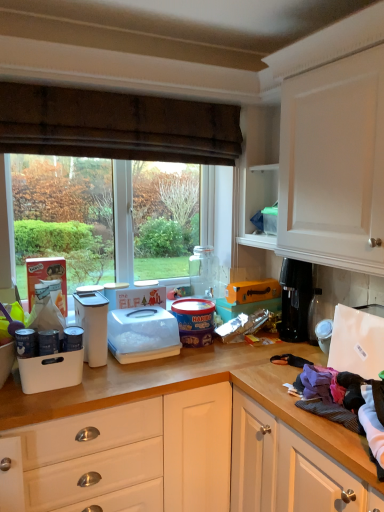
Measure the distance between point (239, 309) and camera.

Point (239, 309) is 7.56 feet from camera.

Measure the distance between white plastic bread bin at center, the fifth appliance positioned from the right, and camera.

1.92 meters.

Where is `transparent glass window at center`? This screenshot has height=512, width=384. transparent glass window at center is located at coordinates (116, 125).

What do you see at coordinates (116, 125) in the screenshot? I see `transparent glass window at center` at bounding box center [116, 125].

Describe the element at coordinates (252, 291) in the screenshot. This screenshot has height=512, width=384. I see `orange cardboard box at center, positioned as the first box in top-to-bottom order` at that location.

Identify the location of metallic silver canister at left, which ranks as the seventh appliance in right-to-left order. The height and width of the screenshot is (512, 384). (26, 342).

From the image's perspective, who appears lower, matte plastic tub at center, which is the 5th appliance from left to right, or white plastic cutting board at right, positioned as the first appliance in right-to-left order?

From the image's view, matte plastic tub at center, which is the 5th appliance from left to right, is below.

Between matte plastic tub at center, placed as the third appliance when sorted from right to left, and white plastic cutting board at right, placed as the 7th appliance when sorted from left to right, which one appears on the left side from the viewer's perspective?

Positioned to the left is matte plastic tub at center, placed as the third appliance when sorted from right to left.

Which object is thinner, matte plastic tub at center, which is the 5th appliance from left to right, or white plastic cutting board at right, positioned as the first appliance in right-to-left order?

With smaller width is white plastic cutting board at right, positioned as the first appliance in right-to-left order.

Considering the relative positions of white plastic container at center, the fourth appliance from the right, and orange matte box at center, placed as the 1th box when sorted from bottom to top, in the image provided, is white plastic container at center, the fourth appliance from the right, to the right of orange matte box at center, placed as the 1th box when sorted from bottom to top, from the viewer's perspective?

In fact, white plastic container at center, the fourth appliance from the right, is to the left of orange matte box at center, placed as the 1th box when sorted from bottom to top.

Which object is further away from the camera taking this photo, white plastic container at center, the fourth appliance from the right, or orange matte box at center, which is the 2th box from top to bottom?

orange matte box at center, which is the 2th box from top to bottom, is further from the camera.

Locate an element on the screen. The width and height of the screenshot is (384, 512). appliance that is the 2nd one when counting leftward from the orange matte box at center, placed as the 1th box when sorted from bottom to top is located at coordinates (142, 334).

From the image's perspective, which one is positioned higher, white plastic container at center, the fourth appliance from the right, or orange matte box at center, which is the 2th box from top to bottom?

orange matte box at center, which is the 2th box from top to bottom, is shown above in the image.

Is point (237, 138) closer or farther from the camera than point (99, 301)?

Clearly, point (237, 138) is more distant from the camera than point (99, 301).

From a real-world perspective, who is located higher, transparent glass window at center or white plastic bread bin at center?

transparent glass window at center, from a real-world perspective.

What's the angular difference between transparent glass window at center and white plastic bread bin at center's facing directions?

The facing directions of transparent glass window at center and white plastic bread bin at center are 1.6 degrees apart.

Does transparent glass window at center contain white plastic bread bin at center?

That's incorrect, white plastic bread bin at center is not inside transparent glass window at center.

Does white plastic cutting board at right, placed as the 7th appliance when sorted from left to right, lie behind matte plastic tub at center, which is the 5th appliance from left to right?

No, it is in front of matte plastic tub at center, which is the 5th appliance from left to right.

From a real-world perspective, is white plastic cutting board at right, placed as the 7th appliance when sorted from left to right, above or below matte plastic tub at center, placed as the third appliance when sorted from right to left?

Clearly, from a real-world perspective, white plastic cutting board at right, placed as the 7th appliance when sorted from left to right, is above matte plastic tub at center, placed as the third appliance when sorted from right to left.

From the image's perspective, which is below, white plastic cutting board at right, placed as the 7th appliance when sorted from left to right, or matte plastic tub at center, placed as the third appliance when sorted from right to left?

matte plastic tub at center, placed as the third appliance when sorted from right to left, appears lower in the image.

From the picture: Is white plastic cutting board at right, positioned as the first appliance in right-to-left order, positioned far away from matte plastic tub at center, placed as the third appliance when sorted from right to left?

That's not correct — white plastic cutting board at right, positioned as the first appliance in right-to-left order, is a little close to matte plastic tub at center, placed as the third appliance when sorted from right to left.

From a real-world perspective, is transparent glass window at center on matte plastic tub at center, placed as the third appliance when sorted from right to left?

Indeed, from a real-world perspective, transparent glass window at center stands above matte plastic tub at center, placed as the third appliance when sorted from right to left.

Which point is more forward, (x=204, y=152) or (x=178, y=310)?

Point (x=178, y=310)

Which object is positioned more to the right, transparent glass window at center or matte plastic tub at center, which is the 5th appliance from left to right?

matte plastic tub at center, which is the 5th appliance from left to right, is more to the right.

Considering the sizes of objects transparent glass window at center and matte plastic tub at center, placed as the third appliance when sorted from right to left, in the image provided, who is thinner, transparent glass window at center or matte plastic tub at center, placed as the third appliance when sorted from right to left,?

Thinner between the two is transparent glass window at center.

Does point (132, 333) appear closer or farther from the camera than point (338, 352)?

Clearly, point (132, 333) is more distant from the camera than point (338, 352).

From their relative heights in the image, would you say white plastic container at center, which is the fourth appliance in left-to-right order, is taller or shorter than white plastic cutting board at right, positioned as the first appliance in right-to-left order?

white plastic container at center, which is the fourth appliance in left-to-right order, is shorter than white plastic cutting board at right, positioned as the first appliance in right-to-left order.

From a real-world perspective, is white plastic container at center, the fourth appliance from the right, positioned above or below white plastic cutting board at right, placed as the 7th appliance when sorted from left to right?

In terms of real-world spatial position, white plastic container at center, the fourth appliance from the right, is below white plastic cutting board at right, placed as the 7th appliance when sorted from left to right.

Relative to white plastic cutting board at right, positioned as the first appliance in right-to-left order, is white plastic container at center, the fourth appliance from the right, in front or behind?

In the image, white plastic container at center, the fourth appliance from the right, appears behind white plastic cutting board at right, positioned as the first appliance in right-to-left order.

How far apart are white plastic bread bin at center and white plastic container at center, which is the fourth appliance in left-to-right order?

They are 5.25 inches apart.

From a real-world perspective, which appliance is the 1st one underneath the white plastic bread bin at center? Please provide its 2D coordinates.

[(142, 334)]

Considering the relative sizes of white plastic bread bin at center and white plastic container at center, which is the fourth appliance in left-to-right order, in the image provided, is white plastic bread bin at center shorter than white plastic container at center, which is the fourth appliance in left-to-right order,?

No.

Between white plastic bread bin at center and white plastic container at center, the fourth appliance from the right, which one is positioned in front?

Positioned in front is white plastic bread bin at center.

Identify the location of the 2nd appliance to the right of the matte plastic tub at center, placed as the third appliance when sorted from right to left, starting your count from the anchor. (357, 342).

Which appliance is the 2nd one when counting from the left side of the orange matte box at center, which is the 2th box from top to bottom? Please provide its 2D coordinates.

[(142, 334)]

Based on their spatial positions, is metallic silver canister at left, which ranks as the seventh appliance in right-to-left order, or white plastic cutting board at right, placed as the 7th appliance when sorted from left to right, closer to matte plastic tub at center, placed as the third appliance when sorted from right to left?

white plastic cutting board at right, placed as the 7th appliance when sorted from left to right, is positioned closer to the anchor matte plastic tub at center, placed as the third appliance when sorted from right to left.

Based on their spatial positions, is orange matte box at center, which is the 2th box from top to bottom, or transparent glass window at center further from white plastic cutting board at right, placed as the 7th appliance when sorted from left to right?

transparent glass window at center lies further to white plastic cutting board at right, placed as the 7th appliance when sorted from left to right, than the other object.

From the image, which object appears to be nearer to white plastic bread bin at center, metallic silver canister at center-left, the second appliance from the left, or brown textured curtain at upper center?

Among the two, metallic silver canister at center-left, the second appliance from the left, is located nearer to white plastic bread bin at center.

Based on their spatial positions, is brown textured curtain at upper center or orange cardboard box at center, which is the 2th box in bottom-to-top order, further from white plastic bread bin at center?

brown textured curtain at upper center.

Based on their spatial positions, is brown textured curtain at upper center or white plastic cutting board at right, placed as the 7th appliance when sorted from left to right, further from white plastic bread bin at center?

white plastic cutting board at right, placed as the 7th appliance when sorted from left to right, is positioned further to the anchor white plastic bread bin at center.

Looking at the image, which one is located further to white plastic bread bin at center, acting as the third appliance starting from the left, white plastic cutting board at right, placed as the 7th appliance when sorted from left to right, or brown textured curtain at upper center?

white plastic cutting board at right, placed as the 7th appliance when sorted from left to right, is positioned further to the anchor white plastic bread bin at center, acting as the third appliance starting from the left.

From the image, which object appears to be farther from orange cardboard box at center, positioned as the first box in top-to-bottom order, black plastic coffee maker at right, arranged as the 6th appliance when viewed from the left, or matte plastic tub at center, which is the 5th appliance from left to right?

matte plastic tub at center, which is the 5th appliance from left to right, is positioned further to the anchor orange cardboard box at center, positioned as the first box in top-to-bottom order.

Considering their positions, is white plastic bread bin at center positioned closer to matte plastic tub at center, which is the 5th appliance from left to right, than orange matte box at center, placed as the 1th box when sorted from bottom to top?

Among the two, orange matte box at center, placed as the 1th box when sorted from bottom to top, is located nearer to matte plastic tub at center, which is the 5th appliance from left to right.

This screenshot has height=512, width=384. Find the location of `curtain situated between white plastic bread bin at center and white plastic cutting board at right, placed as the 7th appliance when sorted from left to right, from left to right`. curtain situated between white plastic bread bin at center and white plastic cutting board at right, placed as the 7th appliance when sorted from left to right, from left to right is located at coordinates (116, 125).

You are a GUI agent. You are given a task and a screenshot of the screen. Output one action in this format:
    pyautogui.click(x=<x>, y=<y>)
    Task: Click on the box between white plastic cutting board at right, placed as the 7th appliance when sorted from left to right, and orange matte box at center, placed as the 1th box when sorted from bottom to top, from front to back
    
    Given the screenshot: What is the action you would take?
    [x=252, y=291]

Identify the location of window between metallic silver canister at left, which ranks as the seventh appliance in right-to-left order, and matte plastic tub at center, placed as the third appliance when sorted from right to left, from left to right. This screenshot has height=512, width=384. (116, 125).

Find the location of a particular element. window between white plastic bread bin at center, acting as the third appliance starting from the left, and black plastic coffee maker at right, the second appliance in the right-to-left sequence is located at coordinates (116, 125).